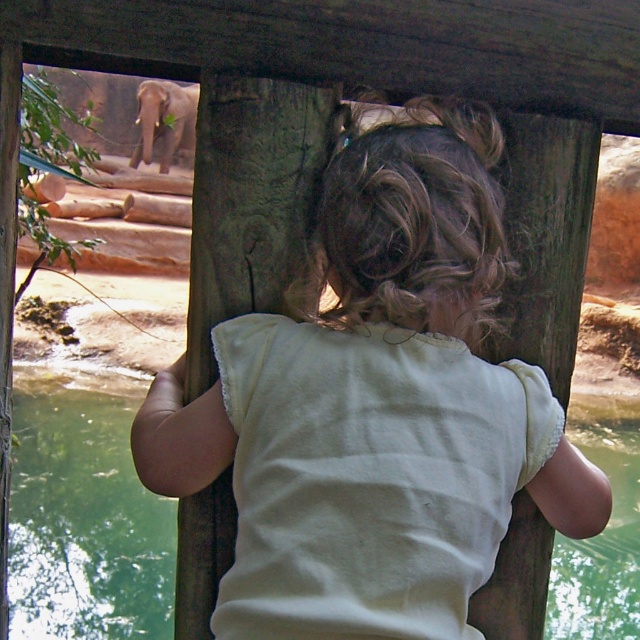
Question: Which object is the farthest from the gray textured elephant at upper left?

Choices:
 (A) light yellow fabric at center
 (B) green liquid water at lower center

Answer: (A)

Question: Which point is farther from the camera taking this photo?

Choices:
 (A) (323, 388)
 (B) (134, 154)

Answer: (B)

Question: Which object appears closest to the camera in this image?

Choices:
 (A) gray textured elephant at upper left
 (B) light yellow fabric at center

Answer: (B)

Question: Does light yellow fabric at center appear on the left side of green liquid water at lower center?

Choices:
 (A) no
 (B) yes

Answer: (B)

Question: Does light yellow fabric at center have a greater width compared to gray textured elephant at upper left?

Choices:
 (A) no
 (B) yes

Answer: (A)

Question: Can you confirm if light yellow fabric at center is wider than gray textured elephant at upper left?

Choices:
 (A) no
 (B) yes

Answer: (A)